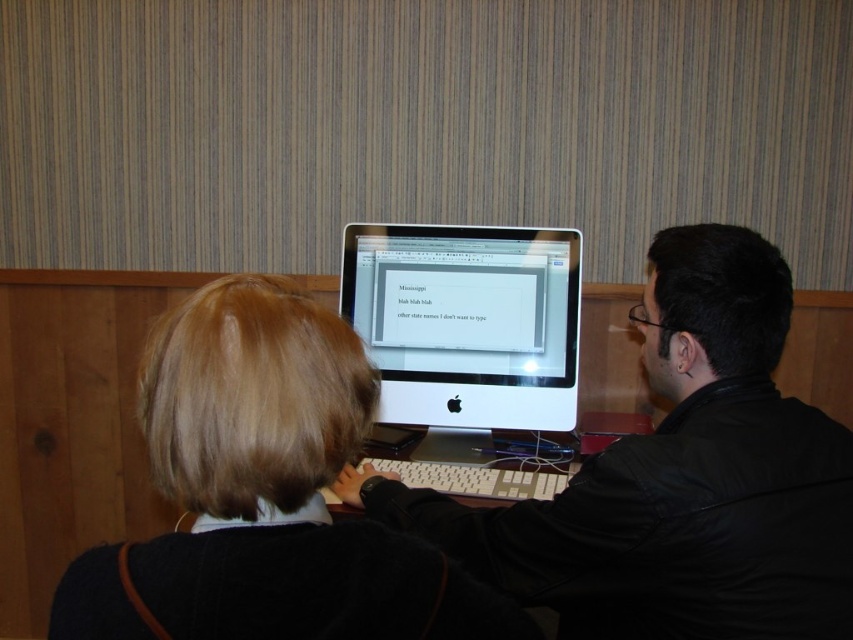
Who is higher up, matte black sweater at center or white glossy computer monitor at center?

white glossy computer monitor at center is higher up.

From the picture: Which of these two, matte black sweater at center or white glossy computer monitor at center, stands taller?

With more height is white glossy computer monitor at center.

The image size is (853, 640). What are the coordinates of `matte black sweater at center` in the screenshot? It's located at (265, 493).

Does matte black computer at center appear over white glossy computer monitor at center?

Incorrect, matte black computer at center is not positioned above white glossy computer monitor at center.

Between matte black computer at center and white glossy computer monitor at center, which one appears on the right side from the viewer's perspective?

Positioned to the right is matte black computer at center.

I want to click on matte black computer at center, so click(x=677, y=477).

What do you see at coordinates (677, 477) in the screenshot?
I see `matte black computer at center` at bounding box center [677, 477].

Who is more distant from viewer, [741,579] or [262,515]?

The point [741,579] is more distant.

Which is in front, point (653, 540) or point (195, 563)?

Point (195, 563) is in front.

This screenshot has width=853, height=640. In order to click on matte black computer at center in this screenshot , I will do `click(677, 477)`.